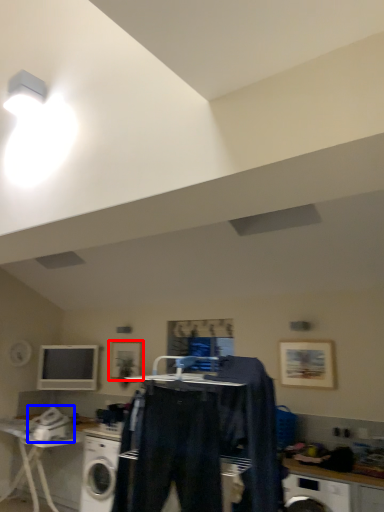
Question: Which object is further to the camera taking this photo, picture frame (highlighted by a red box) or appliance (highlighted by a blue box)?

Choices:
 (A) picture frame
 (B) appliance

Answer: (A)